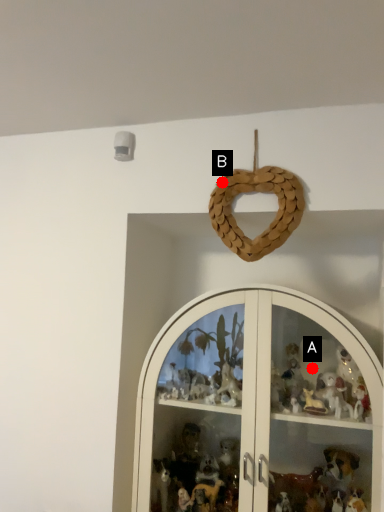
Question: Two points are circled on the image, labeled by A and B beside each circle. Which point is closer to the camera?

Choices:
 (A) A is closer
 (B) B is closer

Answer: (B)